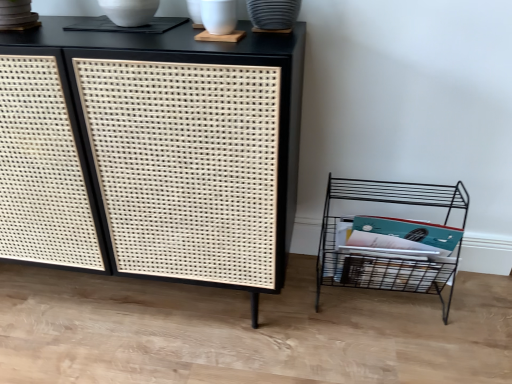
Identify the location of vacant space to the right of black wire shelf at lower right. The image size is (512, 384). (480, 304).